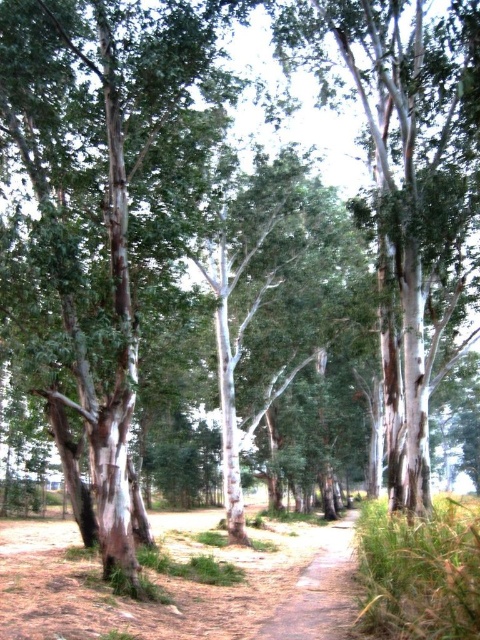
Question: Which object appears farthest from the camera in this image?

Choices:
 (A) dirt path at center
 (B) white bark tree at center
 (C) brown dirt track at center

Answer: (B)

Question: Which point is closer to the camera?

Choices:
 (A) dirt path at center
 (B) brown dirt track at center

Answer: (B)

Question: Does white bark tree at center appear on the right side of dirt path at center?

Choices:
 (A) yes
 (B) no

Answer: (A)

Question: Among these points, which one is farthest from the camera?

Choices:
 (A) (330, 568)
 (B) (432, 128)
 (C) (352, 593)

Answer: (A)

Question: Does brown dirt track at center have a smaller size compared to dirt path at center?

Choices:
 (A) yes
 (B) no

Answer: (B)

Question: Is white bark tree at center bigger than brown dirt track at center?

Choices:
 (A) no
 (B) yes

Answer: (A)